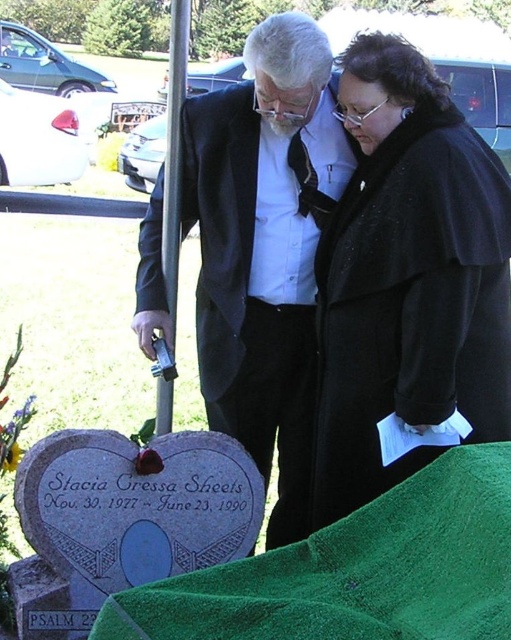
Does matte black suit at center have a lesser height compared to green fabric at lower center?

No, matte black suit at center is not shorter than green fabric at lower center.

Is matte black suit at center closer to the viewer compared to green fabric at lower center?

That is False.

Describe the element at coordinates (265, 246) in the screenshot. Image resolution: width=511 pixels, height=640 pixels. I see `matte black suit at center` at that location.

In order to click on matte black suit at center in this screenshot , I will do `click(265, 246)`.

Which is above, black wool coat at center or green fabric at lower center?

black wool coat at center is above.

This screenshot has height=640, width=511. I want to click on black wool coat at center, so click(x=407, y=276).

Does black wool coat at center have a greater width compared to matte black suit at center?

In fact, black wool coat at center might be narrower than matte black suit at center.

Which is more to the right, black wool coat at center or matte black suit at center?

black wool coat at center

Where is `black wool coat at center`? black wool coat at center is located at coordinates tap(407, 276).

Where is `black wool coat at center`? black wool coat at center is located at coordinates (407, 276).